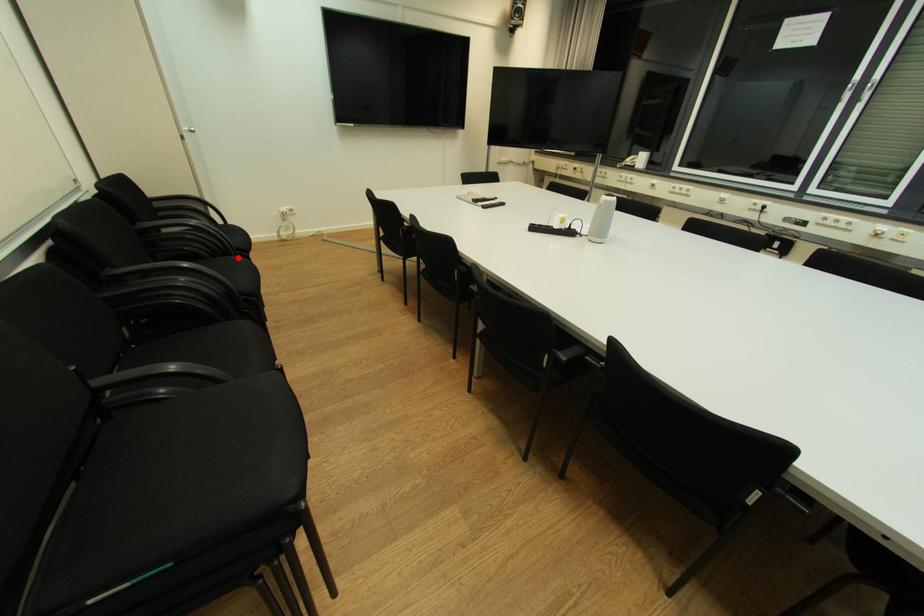
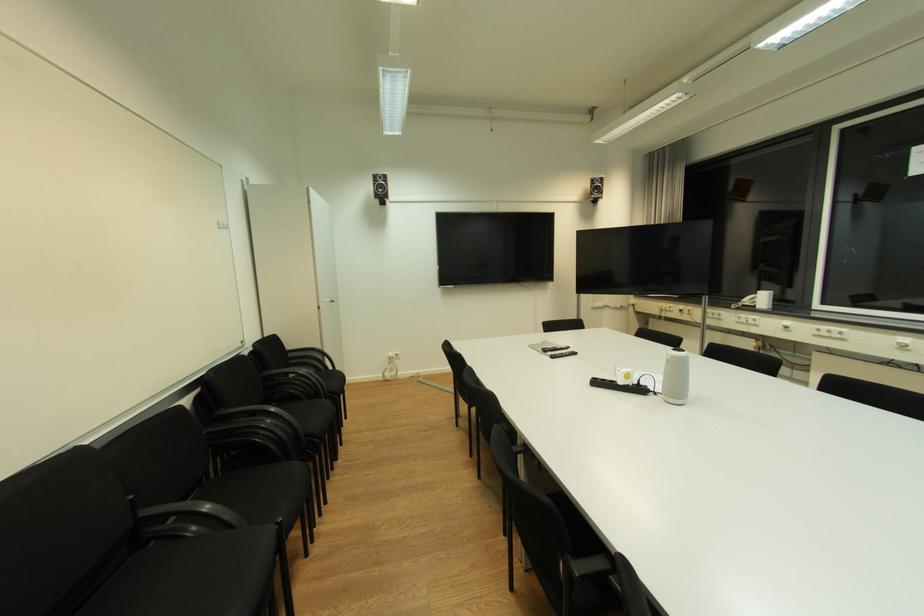
In the second image, find the point that corresponds to the highlighted location in the first image.

(325, 400)